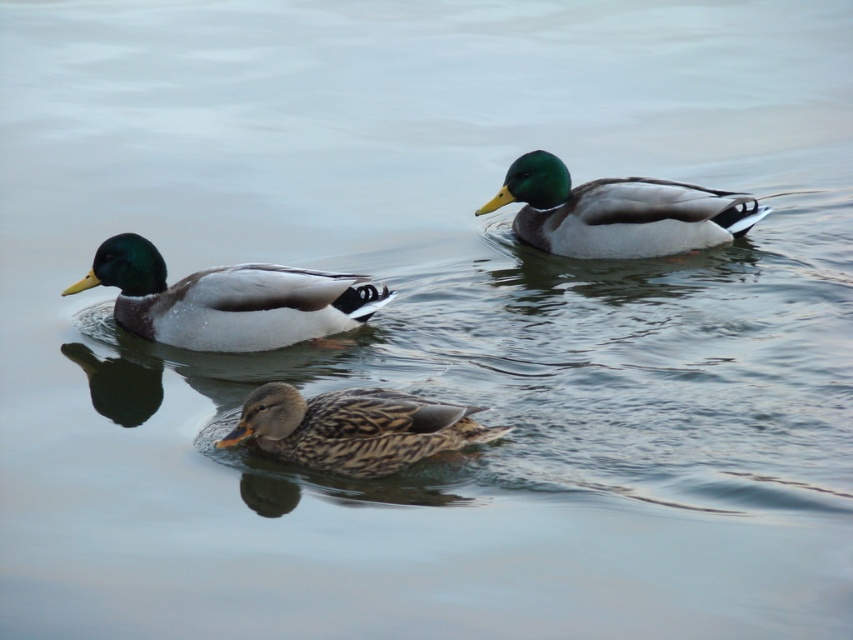
Between green glossy duck at upper right and brown speckled duck at center, which one has less height?

brown speckled duck at center is shorter.

Consider the image. Can you confirm if green glossy duck at upper right is positioned to the right of brown speckled duck at center?

Yes, green glossy duck at upper right is to the right of brown speckled duck at center.

Is point (566, 182) positioned in front of point (254, 416)?

No, (566, 182) is further to viewer.

I want to click on green glossy duck at upper right, so click(618, 212).

Which is above, shiny brown duck at center or green glossy duck at upper right?

green glossy duck at upper right is higher up.

Is shiny brown duck at center smaller than green glossy duck at upper right?

Correct, shiny brown duck at center occupies less space than green glossy duck at upper right.

Looking at this image, who is more distant from viewer, (x=373, y=296) or (x=643, y=196)?

The point (x=643, y=196) is more distant.

This screenshot has width=853, height=640. Find the location of `shiny brown duck at center`. shiny brown duck at center is located at coordinates (227, 300).

Can you confirm if shiny brown duck at center is smaller than brown speckled duck at center?

Incorrect, shiny brown duck at center is not smaller in size than brown speckled duck at center.

Can you confirm if shiny brown duck at center is positioned below brown speckled duck at center?

No.

Between point (160, 269) and point (328, 436), which one is positioned in front?

Point (328, 436) is in front.

This screenshot has width=853, height=640. In order to click on shiny brown duck at center in this screenshot , I will do tap(227, 300).